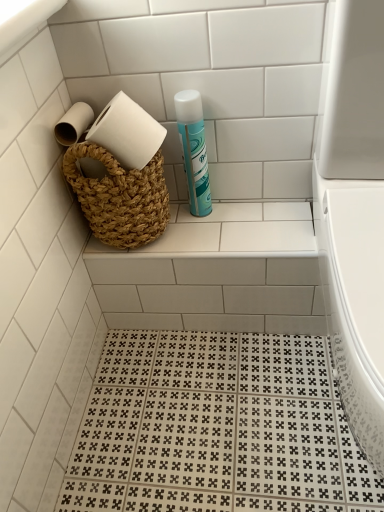
Question: In the image, is white glossy toilet at right positioned in front of or behind natural woven basket at upper center?

Choices:
 (A) behind
 (B) front

Answer: (B)

Question: In terms of width, does white glossy toilet at right look wider or thinner when compared to natural woven basket at upper center?

Choices:
 (A) wide
 (B) thin

Answer: (A)

Question: Which object is positioned closest to the white glossy toilet at right?

Choices:
 (A) teal matte cleaning product at upper center
 (B) natural woven basket at upper center

Answer: (B)

Question: Considering the real-world distances, which object is closest to the teal matte cleaning product at upper center?

Choices:
 (A) natural woven basket at upper center
 (B) white glossy toilet at right

Answer: (A)